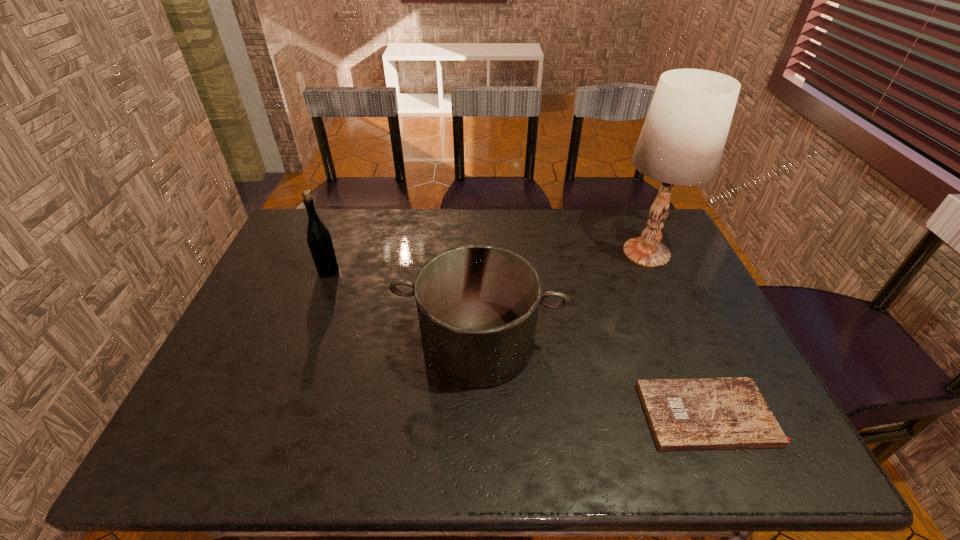
Find the location of a particular element. Image resolution: width=960 pixels, height=540 pixels. lamp is located at coordinates (682, 140).

Find the location of a particular element. the second tallest object is located at coordinates (319, 239).

The width and height of the screenshot is (960, 540). I want to click on the leftmost object, so click(319, 239).

You are a GUI agent. You are given a task and a screenshot of the screen. Output one action in this format:
    pyautogui.click(x=<x>, y=<y>)
    Task: Click on the third object from right to left
    
    Given the screenshot: What is the action you would take?
    pyautogui.click(x=477, y=305)

Image resolution: width=960 pixels, height=540 pixels. I want to click on pan, so click(x=477, y=305).

Locate an element on the screen. This screenshot has width=960, height=540. Bible is located at coordinates (699, 413).

You are a GUI agent. You are given a task and a screenshot of the screen. Output one action in this format:
    pyautogui.click(x=<x>, y=<y>)
    Task: Click on the blank space located 0.360m on the left of the tallest object
    The image size is (960, 540).
    Given the screenshot: What is the action you would take?
    pyautogui.click(x=500, y=253)

The width and height of the screenshot is (960, 540). Identify the location of vacant point located on the back of the leftmost object. (351, 214).

At what (x,y) coordinates should I click in order to perform the action: click on vacant region located on the right of the second object from left to right. Please return your answer as a coordinate pair (x, y). Looking at the image, I should click on (606, 342).

At what (x,y) coordinates should I click in order to perform the action: click on vacant space located 0.300m on the back of the shortest object. Please return your answer as a coordinate pair (x, y). Image resolution: width=960 pixels, height=540 pixels. Looking at the image, I should click on (658, 295).